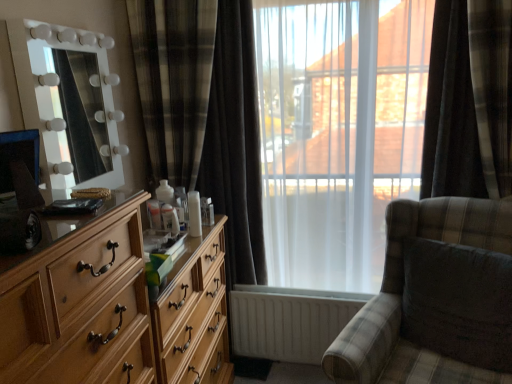
This screenshot has height=384, width=512. Find the location of `vacant area on top of white plastic radiator at lower center (from a real-world perspective)`. vacant area on top of white plastic radiator at lower center (from a real-world perspective) is located at coordinates (317, 301).